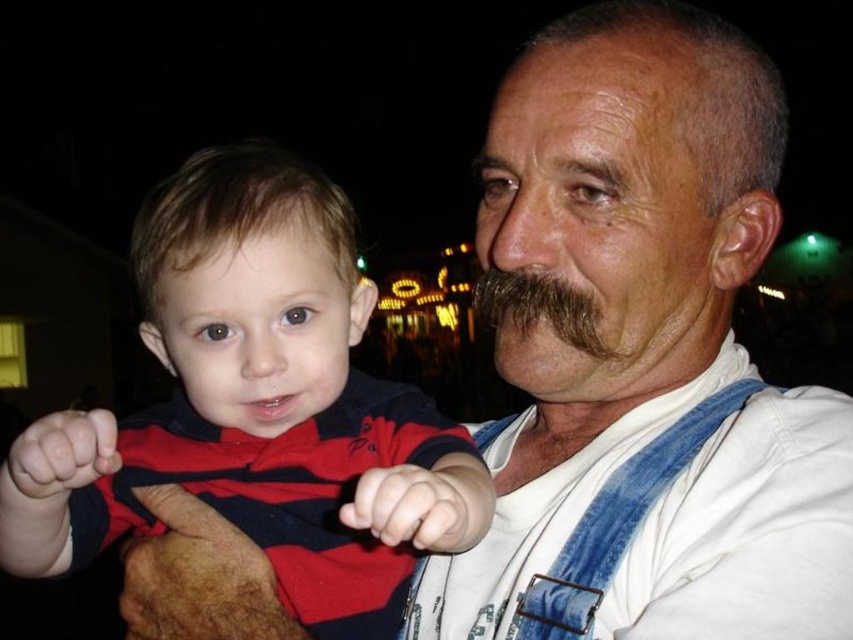
You are a photographer adjusting the focus on your camera. You want to capture the striped cotton shirt at left clearly. The focus point is currently at point (257, 406). Is the focus point on the striped cotton shirt at left?

Yes, the focus point at (257, 406) is on the striped cotton shirt at left, so the focus is correctly placed to capture it clearly.

You are a photographer adjusting your camera settings. You notice two points in the image at coordinates point [664,442] and point [581,323]. Which point is nearer to your camera lens?

Point [664,442] is closer to the viewer than point [581,323], so the point at [664,442] is nearer to the camera lens.